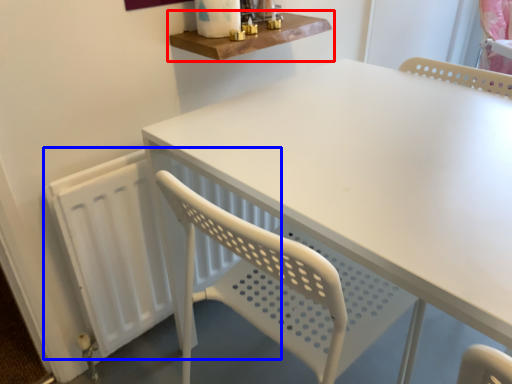
Question: Which point is further to the camera, shelf (highlighted by a red box) or radiator (highlighted by a blue box)?

Choices:
 (A) shelf
 (B) radiator

Answer: (A)